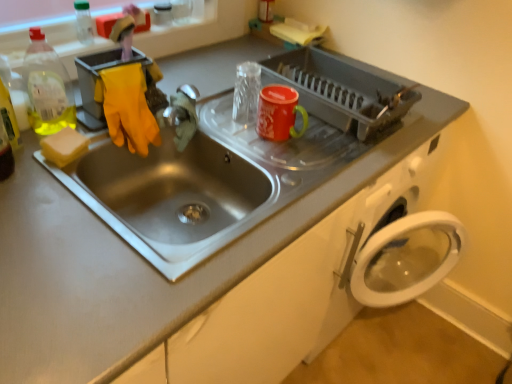
Question: Is metallic silver faucet at sink center turned away from matte plastic dish rack at upper center?

Choices:
 (A) no
 (B) yes

Answer: (A)

Question: From a real-world perspective, is metallic silver faucet at sink center positioned under matte plastic dish rack at upper center based on gravity?

Choices:
 (A) yes
 (B) no

Answer: (A)

Question: Is metallic silver faucet at sink center shorter than matte plastic dish rack at upper center?

Choices:
 (A) no
 (B) yes

Answer: (A)

Question: Can you confirm if metallic silver faucet at sink center is positioned to the right of matte plastic dish rack at upper center?

Choices:
 (A) no
 (B) yes

Answer: (A)

Question: Is metallic silver faucet at sink center bigger than matte plastic dish rack at upper center?

Choices:
 (A) no
 (B) yes

Answer: (A)

Question: From the image's perspective, does metallic silver faucet at sink center appear lower than matte plastic dish rack at upper center?

Choices:
 (A) no
 (B) yes

Answer: (B)

Question: From the image's perspective, is yellow sponge at left beneath clear plastic bottle at upper left, the 2th bottle when ordered from front to back?

Choices:
 (A) no
 (B) yes

Answer: (B)

Question: Could you tell me if yellow sponge at left is turned towards clear plastic bottle at upper left, acting as the first bottle starting from the top?

Choices:
 (A) no
 (B) yes

Answer: (A)

Question: Does yellow sponge at left have a greater width compared to clear plastic bottle at upper left, which is the second bottle in bottom-to-top order?

Choices:
 (A) yes
 (B) no

Answer: (A)

Question: Is yellow sponge at left to the right of clear plastic bottle at upper left, which ranks as the 1th bottle in back-to-front order, from the viewer's perspective?

Choices:
 (A) yes
 (B) no

Answer: (A)

Question: From the image's perspective, is yellow sponge at left on clear plastic bottle at upper left, which ranks as the 1th bottle in back-to-front order?

Choices:
 (A) no
 (B) yes

Answer: (A)

Question: Is yellow sponge at left positioned behind clear plastic bottle at upper left, which is the second bottle in bottom-to-top order?

Choices:
 (A) yes
 (B) no

Answer: (B)

Question: Is yellow sponge at left located outside metallic silver faucet at sink center?

Choices:
 (A) yes
 (B) no

Answer: (A)